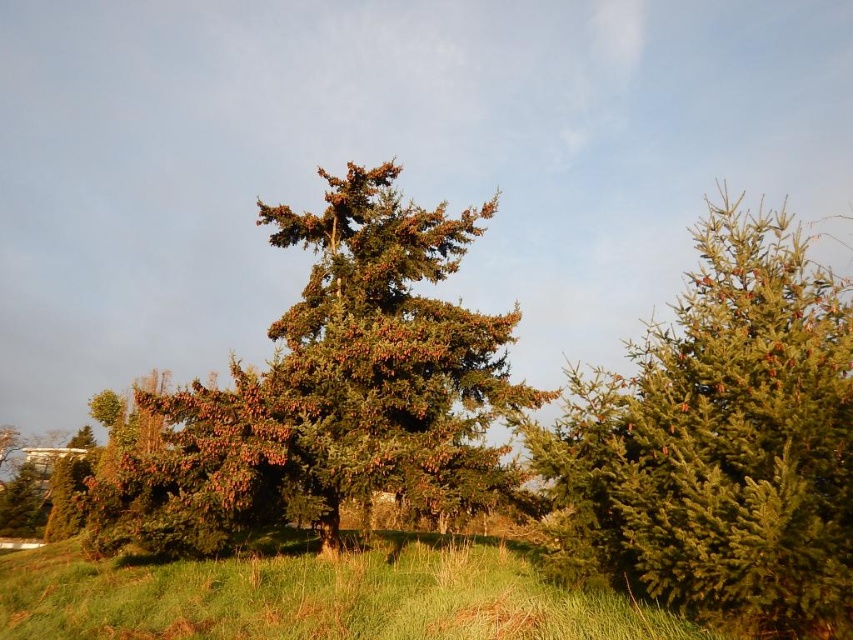
Can you confirm if green matte evergreen tree at right is shorter than green grass at center?

No, green matte evergreen tree at right is not shorter than green grass at center.

Who is more forward, (759, 580) or (659, 616)?

Positioned in front is point (759, 580).

I want to click on green matte evergreen tree at right, so click(720, 444).

Who is lower down, green textured tree at center or green grass at center?

green grass at center

Is point (190, 524) farther from viewer compared to point (527, 589)?

Yes, point (190, 524) is behind point (527, 589).

Find the location of a particular element. The image size is (853, 640). green textured tree at center is located at coordinates (337, 385).

Is green matte evergreen tree at right bigger than green textured tree at center?

Yes, green matte evergreen tree at right is bigger than green textured tree at center.

Does green matte evergreen tree at right have a greater height compared to green textured tree at center?

Indeed, green matte evergreen tree at right has a greater height compared to green textured tree at center.

The width and height of the screenshot is (853, 640). Describe the element at coordinates (720, 444) in the screenshot. I see `green matte evergreen tree at right` at that location.

The image size is (853, 640). Identify the location of green matte evergreen tree at right. (720, 444).